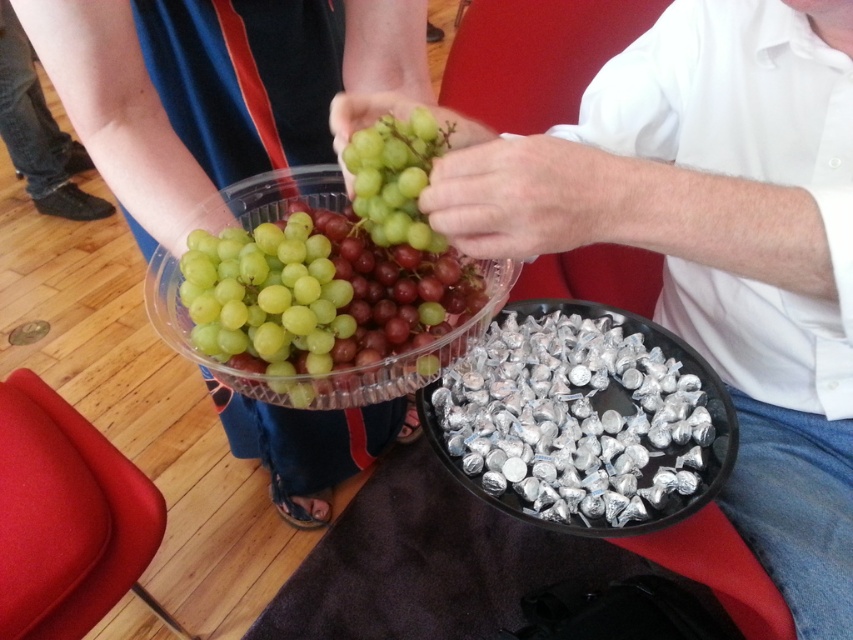
Consider the image. You are at a party and see two types of grapes, the green matte grapes at upper left and the translucent plastic grapes at center. Which grapes are located lower in the image?

The green matte grapes at upper left are positioned under the translucent plastic grapes at center, so they are located lower in the image.

What object is located at the coordinates point (265, 300) in the image?

The point (265, 300) corresponds to the green matte grapes at center.